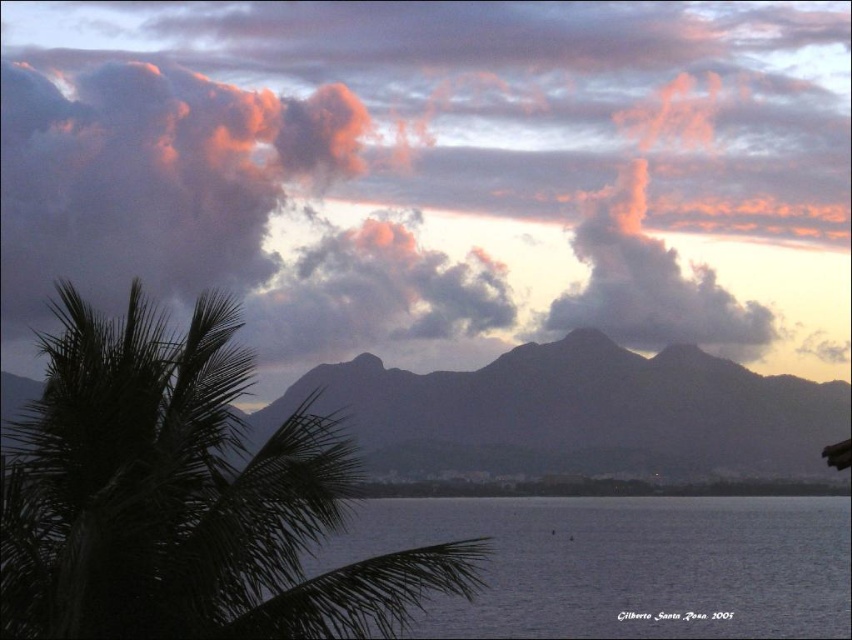
Question: Can you confirm if pink fluffy cloud at upper center is positioned to the right of transparent blue water at center?

Choices:
 (A) no
 (B) yes

Answer: (A)

Question: Which object is the closest to the silhouetted rock at center?

Choices:
 (A) transparent blue water at center
 (B) pink fluffy cloud at upper center
 (C) dark green leafy palm tree at left

Answer: (B)

Question: Can you confirm if pink fluffy cloud at upper center is positioned above transparent blue water at center?

Choices:
 (A) yes
 (B) no

Answer: (A)

Question: Among these points, which one is nearest to the camera?

Choices:
 (A) (327, 531)
 (B) (740, 548)
 (C) (758, 451)

Answer: (A)

Question: Which of these objects is positioned closest to the dark green leafy palm tree at left?

Choices:
 (A) transparent blue water at center
 (B) pink fluffy cloud at upper center
 (C) silhouetted rock at center

Answer: (A)

Question: Is transparent blue water at center in front of silhouetted rock at center?

Choices:
 (A) no
 (B) yes

Answer: (B)